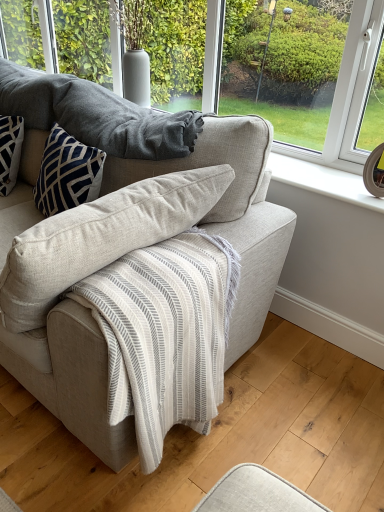
Question: Is light beige fabric couch at center taller or shorter than transparent glass window at upper center?

Choices:
 (A) short
 (B) tall

Answer: (B)

Question: Is point (0, 232) closer or farther from the camera than point (170, 42)?

Choices:
 (A) farther
 (B) closer

Answer: (B)

Question: Estimate the real-world distances between objects in this image. Which object is farther from the light beige fabric couch at center?

Choices:
 (A) textured wool blanket at upper center
 (B) transparent glass window at upper center

Answer: (B)

Question: Based on their relative distances, which object is nearer to the transparent glass window at upper center?

Choices:
 (A) light beige fabric couch at center
 (B) textured wool blanket at upper center

Answer: (B)